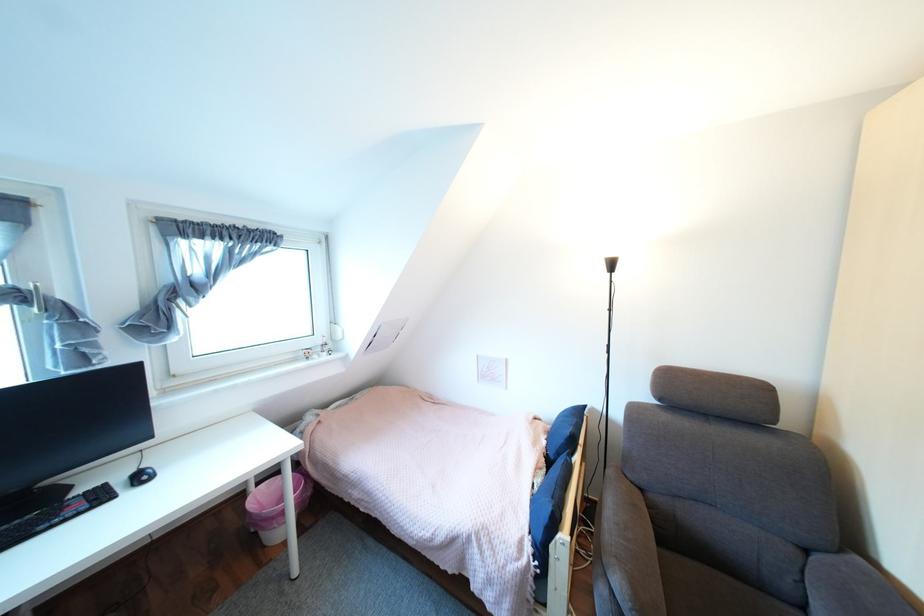
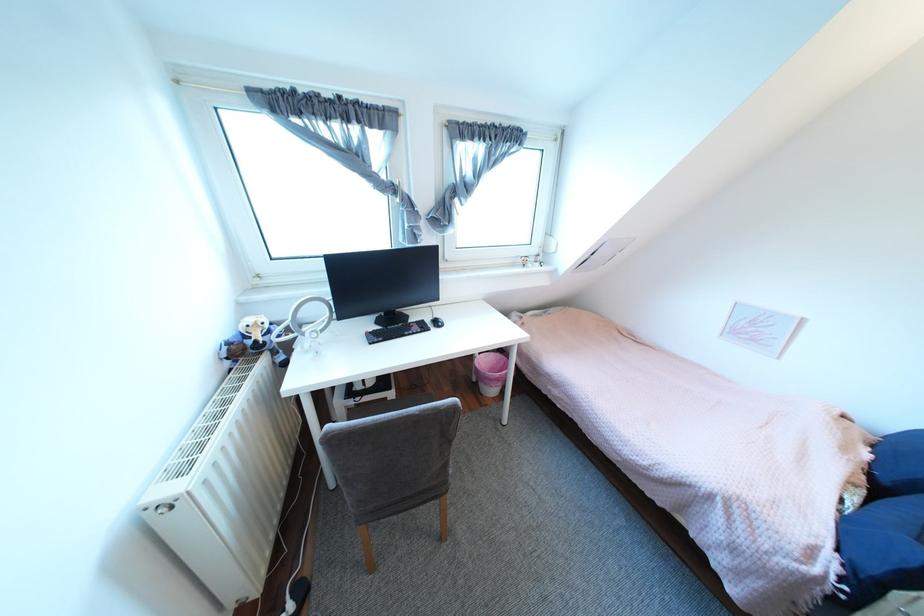
In the second image, find the point that corresponds to [553,554] in the first image.

(873, 586)